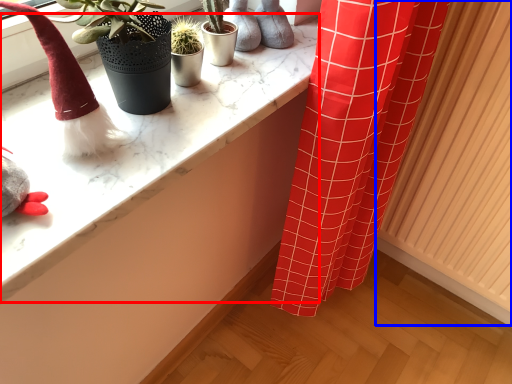
Question: Which of the following is the farthest to the observer, counter top (highlighted by a red box) or radiator (highlighted by a blue box)?

Choices:
 (A) counter top
 (B) radiator

Answer: (B)